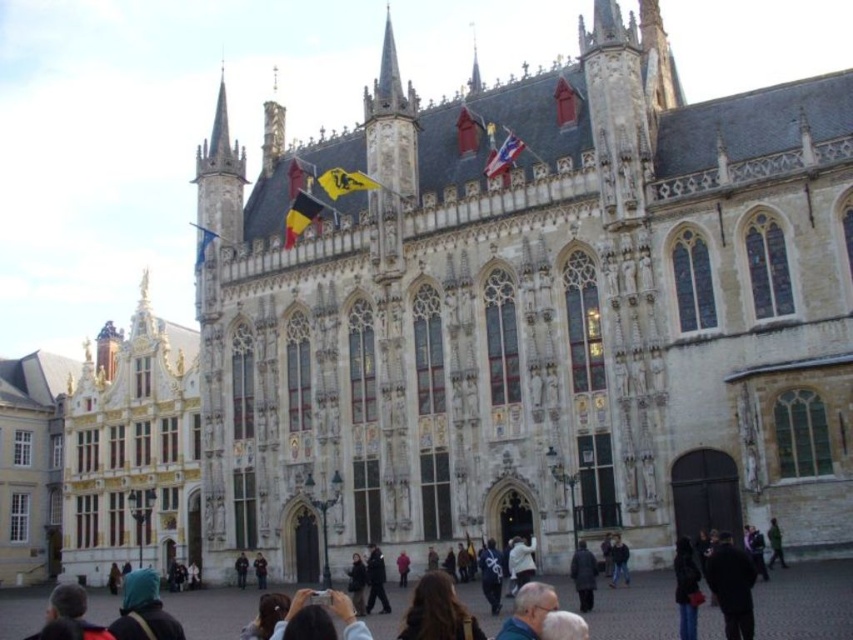
Is yellow fabric flag at upper center wider than dark gray jacket at center?

Indeed, yellow fabric flag at upper center has a greater width compared to dark gray jacket at center.

Is yellow fabric flag at upper center to the right of dark gray jacket at center from the viewer's perspective?

Incorrect, yellow fabric flag at upper center is not on the right side of dark gray jacket at center.

Between point (379, 184) and point (358, 604), which one is positioned in front?

Point (358, 604) is in front.

Locate an element on the screen. The image size is (853, 640). yellow fabric flag at upper center is located at coordinates (344, 180).

Who is more distant from viewer, (x=444, y=621) or (x=706, y=572)?

Positioned behind is point (x=706, y=572).

The height and width of the screenshot is (640, 853). Find the location of `brown hair at center`. brown hair at center is located at coordinates (438, 611).

Measure the distance between dark blue hooded jacket at lower left and camera.

dark blue hooded jacket at lower left and camera are 28.77 meters apart.

Which is above, dark blue hooded jacket at lower left or shiny metallic flag at upper center?

shiny metallic flag at upper center is higher up.

Is point (114, 632) positioned before point (502, 172)?

Yes, it is.

Image resolution: width=853 pixels, height=640 pixels. In order to click on dark blue hooded jacket at lower left in this screenshot , I will do `click(143, 609)`.